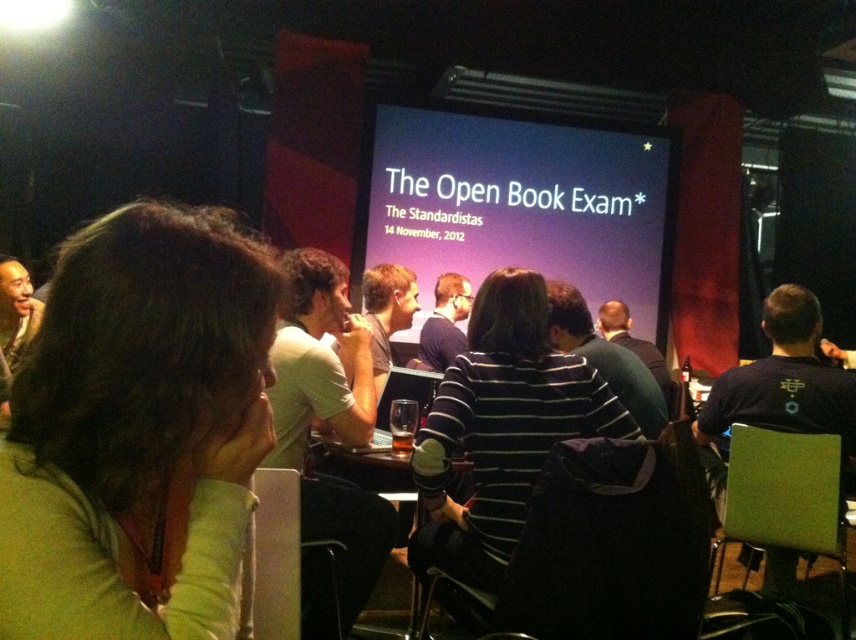
In the scene shown: Between green fabric shirt at lower left and white shirt at center, which one is positioned lower?

white shirt at center is below.

Which is in front, point (150, 497) or point (360, 593)?

Positioned in front is point (150, 497).

Where is `green fabric shirt at lower left`? green fabric shirt at lower left is located at coordinates (138, 433).

Is point (138, 349) farther from camera compared to point (390, 240)?

No, it is not.

Who is higher up, green fabric shirt at lower left or purple matte screen at center?

purple matte screen at center

Between point (57, 602) and point (522, 141), which one is positioned in front?

Positioned in front is point (57, 602).

Where is `green fabric shirt at lower left`? This screenshot has height=640, width=856. green fabric shirt at lower left is located at coordinates (x=138, y=433).

Can you confirm if white shirt at center is shorter than purple matte shirt at center?

No.

Is point (336, 364) positioned in front of point (461, 292)?

Yes, point (336, 364) is in front of point (461, 292).

Between point (284, 403) and point (440, 326), which one is positioned behind?

The point (440, 326) is more distant.

Where is `white shirt at center`? white shirt at center is located at coordinates (318, 358).